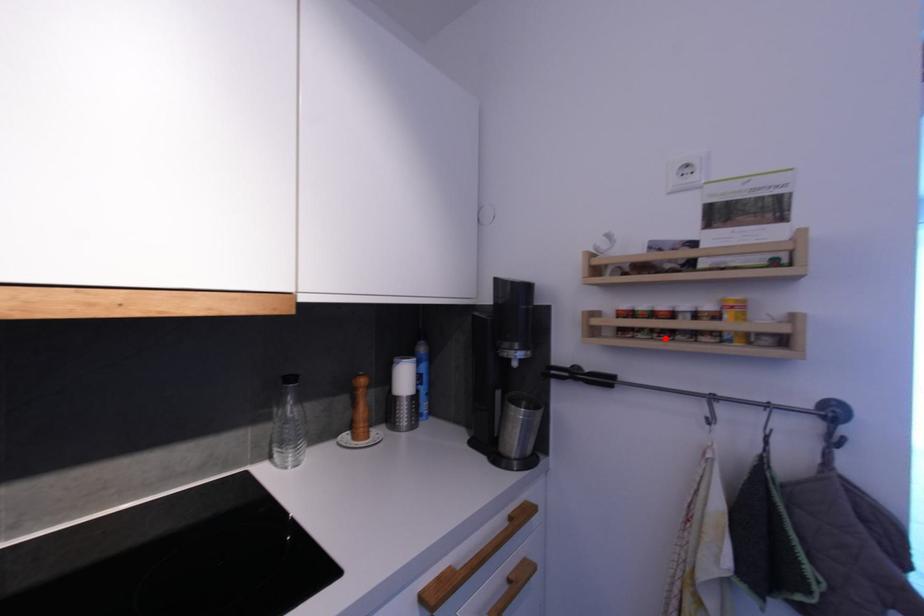
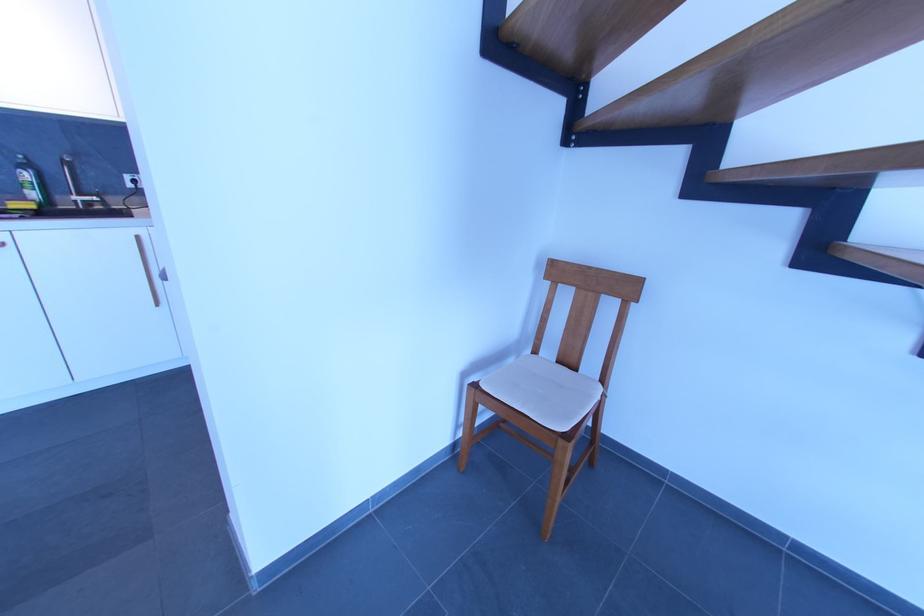
Question: I am providing you with two images of the same scene from different viewpoints. A red point is marked on the first image. At the location where the point appears in image 1, is it still visible in image 2?

Choices:
 (A) Yes
 (B) No

Answer: (B)